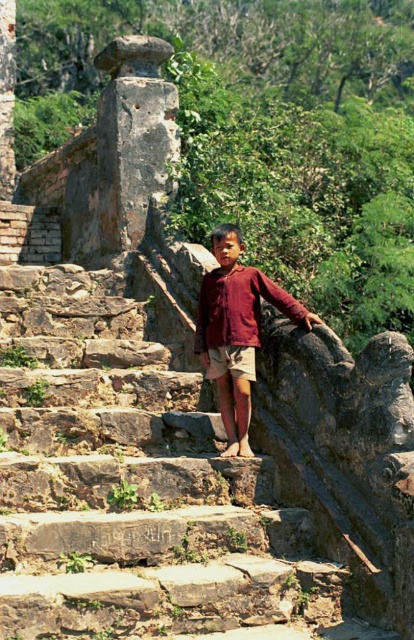
You are an architect examining the stone structure in the image. You need to determine which of the two points, point (12, 620) or point (231, 340), is closer to the camera. Based on the scene description, which point is nearer?

Point (12, 620) is closer to the viewer than point (231, 340).

The boy in the image is wearing a matte red shirt at center and khaki cotton shorts at center. If the shirt is positioned over the shorts, which clothing item would you see more of when looking at the boy from the front?

The matte red shirt at center is positioned over the khaki cotton shorts at center, so more of the matte red shirt at center would be visible from the front.

You are a photographer trying to capture the boy in the image. Since the matte red shirt at center and the khaki cotton shorts at center are both in the frame, which one should you focus on to ensure the entire clothing item is in focus, considering their sizes?

The matte red shirt at center is much taller than the khaki cotton shorts at center, so focusing on the matte red shirt at center would ensure the entire clothing item is in focus due to its larger size.